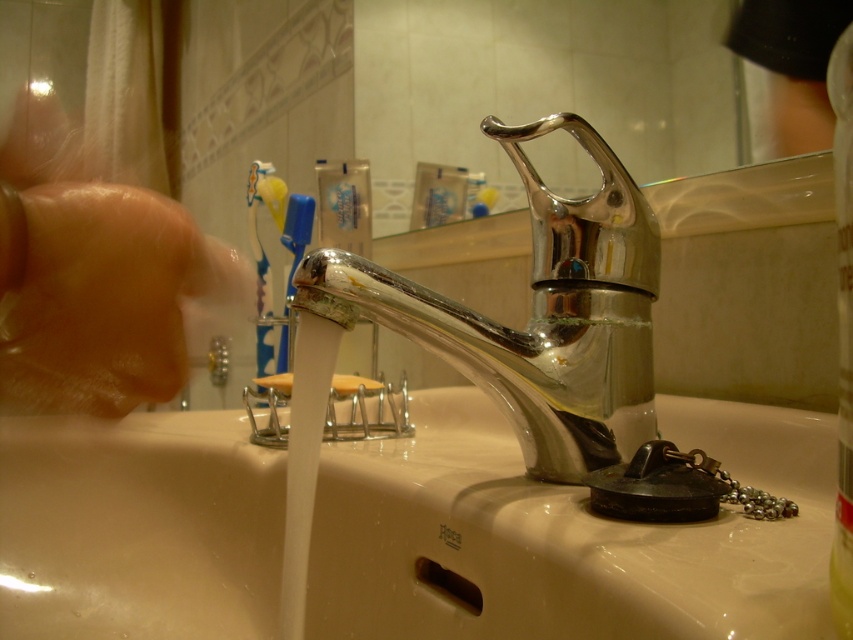
You are trying to adjust the water temperature at the sink. Since the polished chrome faucet at center controls the water flow, where would you need to reach relative to the white glossy sink at center to turn it on?

The polished chrome faucet at center is above the white glossy sink at center, so you would need to reach upward to turn it on.

You are a plumber inspecting a bathroom sink. You notice the polished chrome faucet at center and the dry skin at left. Which object is taller?

The polished chrome faucet at center is taller than the dry skin at left.

You are standing in front of the bathroom sink. You want to touch both the polished chrome faucet at center and the dry skin at left. Which object should you reach for first to touch the one closer to you?

You should reach for the polished chrome faucet at center first because it is closer to you than the dry skin at left.